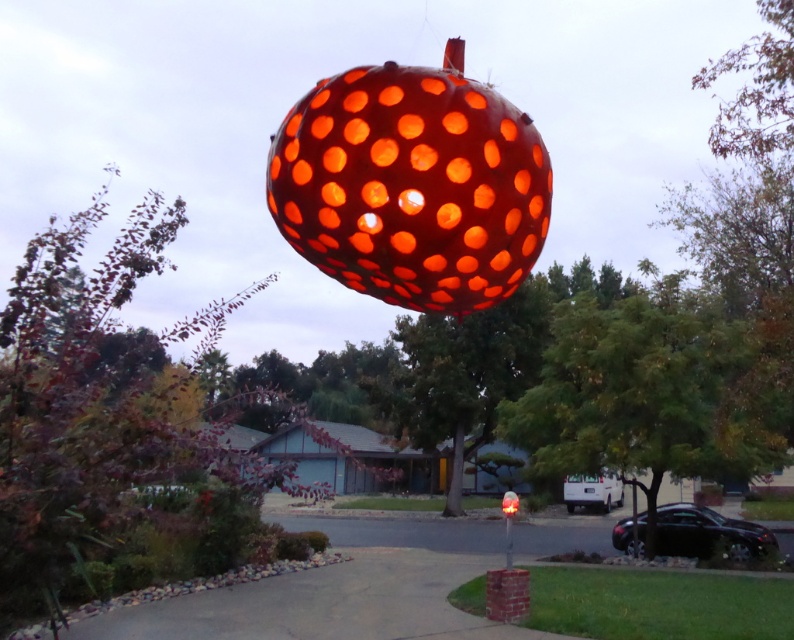
Question: Is the position of translucent orange sphere at center less distant than that of green leafy tree at center?

Choices:
 (A) no
 (B) yes

Answer: (B)

Question: Which object is positioned closest to the green leafy tree at upper center?

Choices:
 (A) green leafy tree at center
 (B) translucent orange sphere at center

Answer: (A)

Question: Which point is closer to the camera taking this photo?

Choices:
 (A) click(x=696, y=403)
 (B) click(x=230, y=484)
 (C) click(x=397, y=96)

Answer: (C)

Question: Is green leafy tree at upper center thinner than green leafy tree at center?

Choices:
 (A) no
 (B) yes

Answer: (A)

Question: Does translucent orange sphere at center appear over green leafy tree at center?

Choices:
 (A) no
 (B) yes

Answer: (B)

Question: Among these objects, which one is farthest from the camera?

Choices:
 (A) green leafy tree at upper center
 (B) translucent orange sphere at center
 (C) green leafy tree at center

Answer: (C)